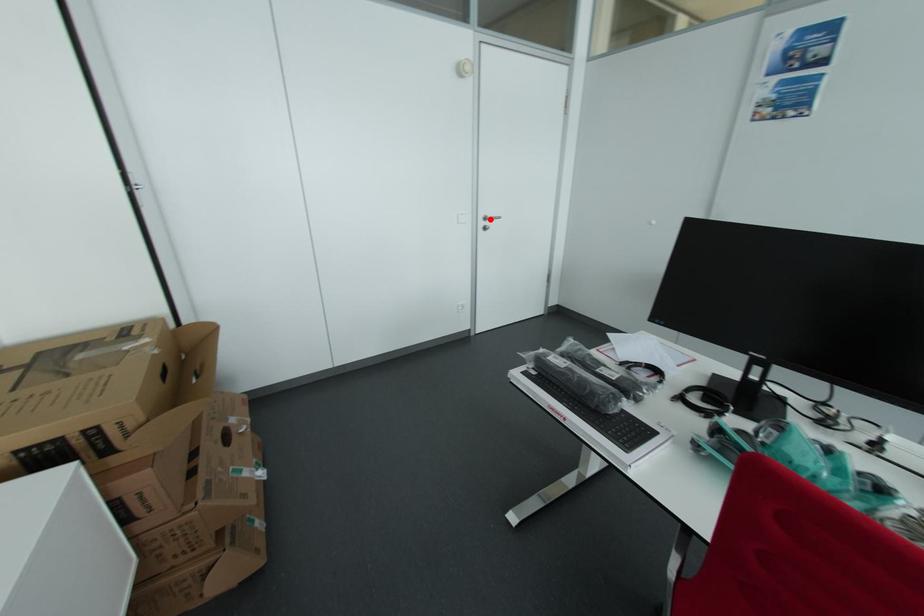
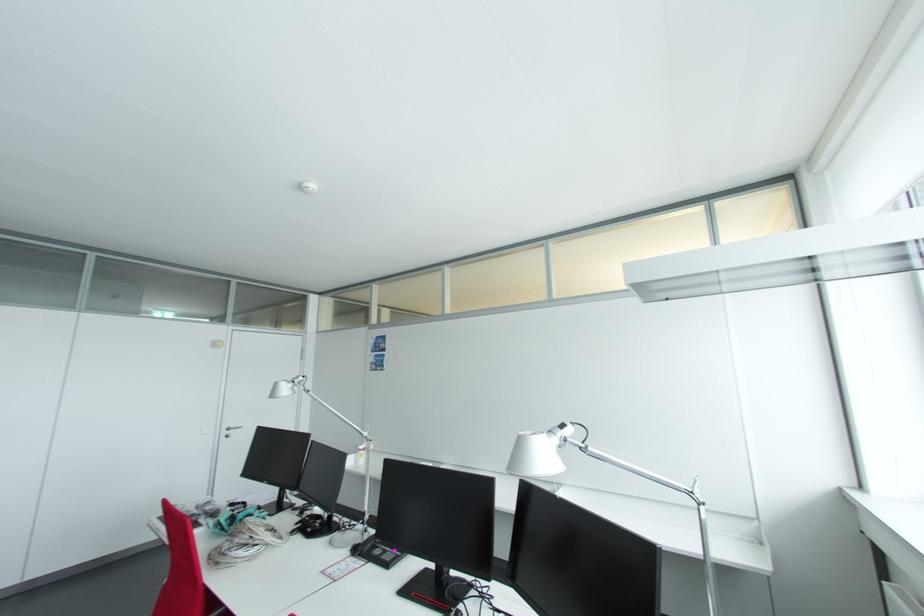
Locate, in the second image, the point that corresponds to the highlighted location in the first image.

(232, 430)